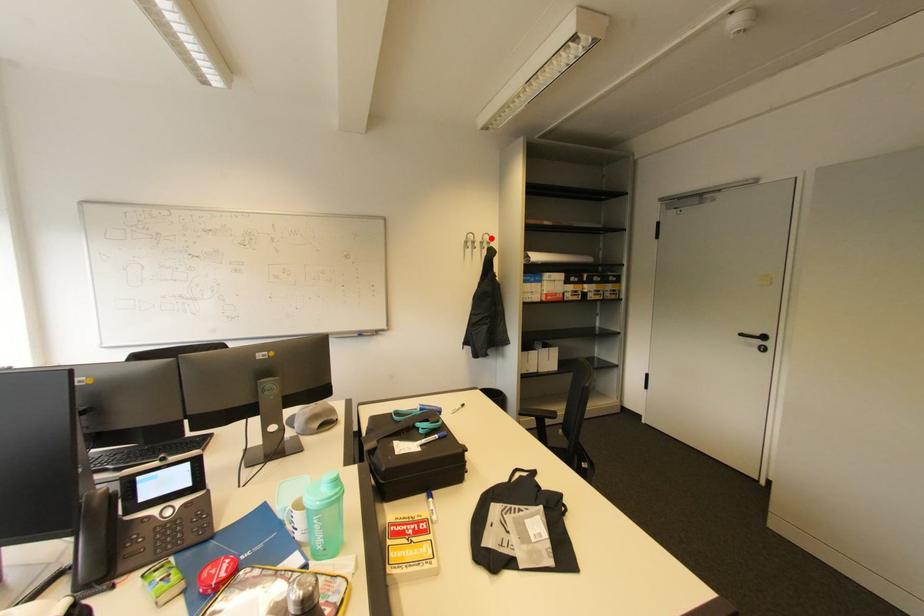
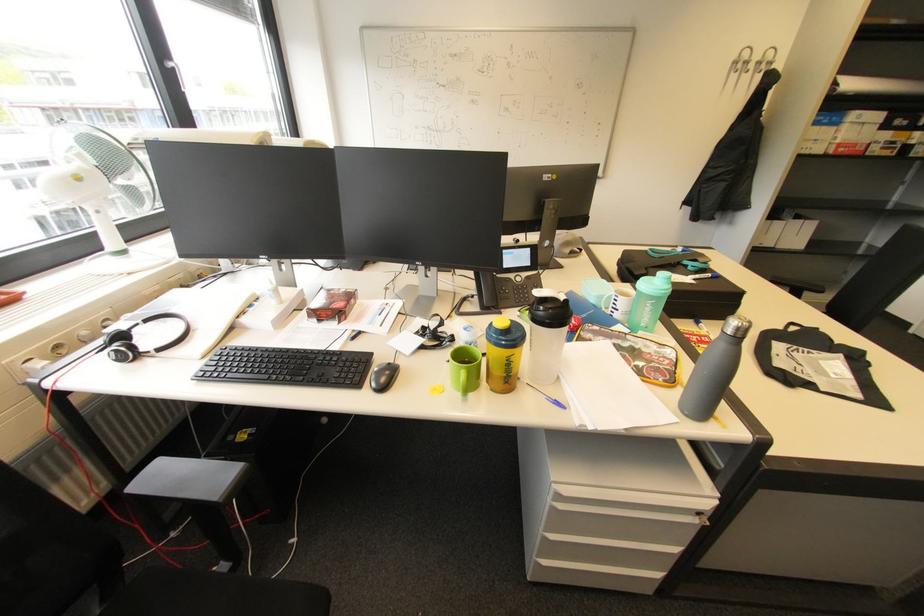
In the second image, find the point that corresponds to the highlighted location in the first image.

(775, 55)